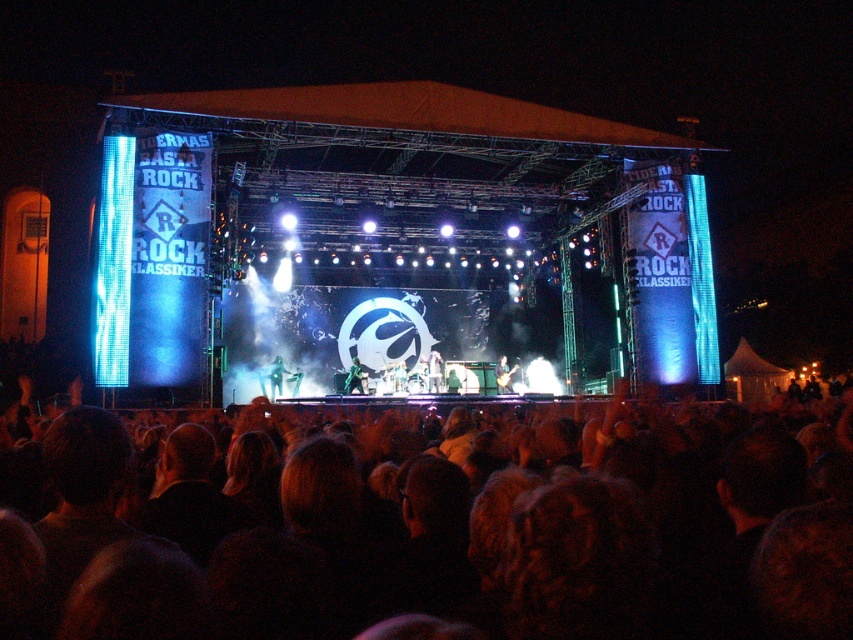
You are a photographer at the concert. You want to capture a photo that includes both the black fabric crowd at lower center and the green fabric figure at center stage. Which one will occupy more space in the photo?

The black fabric crowd at lower center has a larger size compared to the green fabric figure at center stage, so it will occupy more space in the photo.

You are a photographer at the concert and want to capture a photo of both the green metallic guitar at stage center and the metallic silver guitar at center. From the audience perspective, which guitar should you focus on first to ensure both are in frame?

The green metallic guitar at stage center is to the left of metallic silver guitar at center, so you should focus on the green metallic guitar at stage center first to ensure both are in frame.

You are a drone operator trying to capture aerial footage of the concert. The camera is positioned at a certain height. There is a specific point marked at coordinates point (502, 355) that you need to focus on. Given that the distance from the camera to this point is 117.83 meters, can you estimate how far the camera is from the ground if the point is located 10 meters above the ground?

The point at (502, 355) is 10 meters above the ground and 117.83 meters away from the camera. Therefore, the camera is approximately 117.83 meters away from the point, but since the point is 10 meters above the ground, the camera could be either 10 meters plus or minus the vertical distance depending on its angle. Without knowing the exact angle or height difference, we cannot precisely determine the camera height. However, if the camera is directly above the point, the height would be roughly 117.83 plus